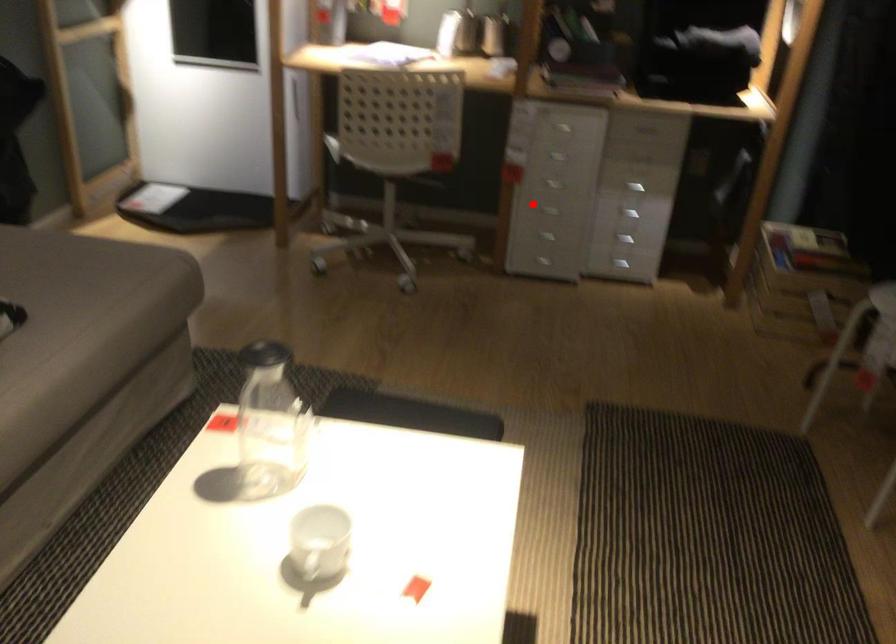
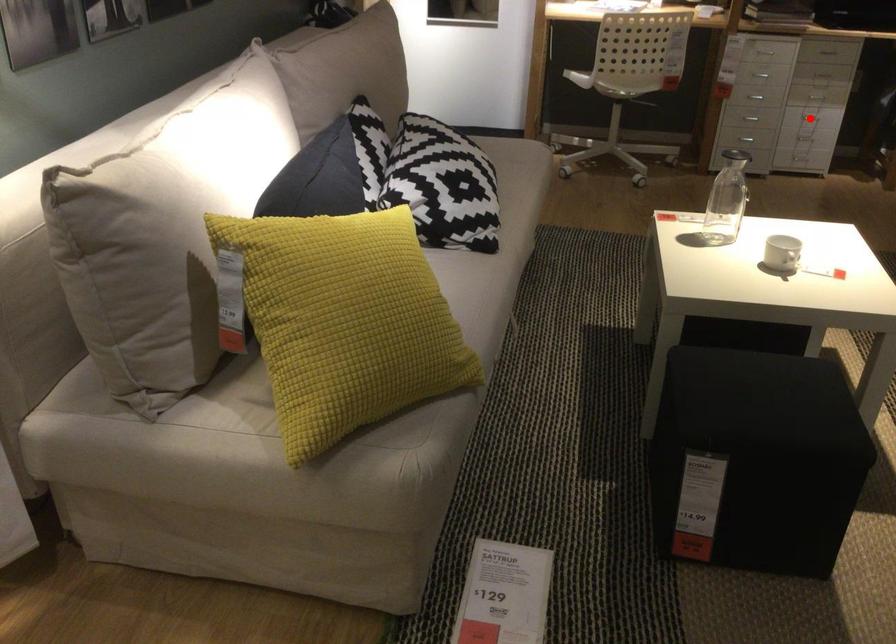
I am providing you with two images of the same scene from different viewpoints. A red point is marked on the first image and another point is marked on the second image. Does the point marked in image1 correspond to the same location as the one in image2?

No